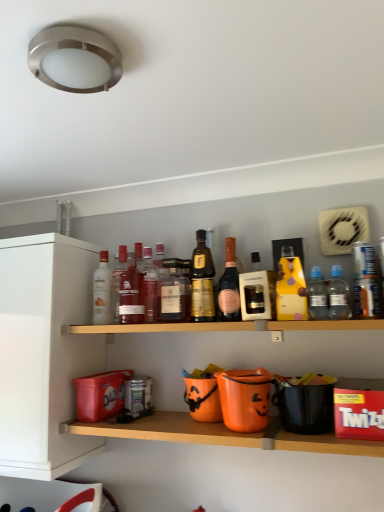
Question: Does matte glass bottle at center, acting as the second bottle starting from the left, have a greater height compared to clear plastic bottle at center right, placed as the 2th bottle when sorted from right to left?

Choices:
 (A) yes
 (B) no

Answer: (A)

Question: Can you see matte glass bottle at center, acting as the second bottle starting from the left, touching clear plastic bottle at center right, placed as the 2th bottle when sorted from right to left?

Choices:
 (A) no
 (B) yes

Answer: (A)

Question: From the image's perspective, is matte glass bottle at center, marked as the eighth bottle in a right-to-left arrangement, above clear plastic bottle at center right, placed as the 2th bottle when sorted from right to left?

Choices:
 (A) no
 (B) yes

Answer: (A)

Question: Can you confirm if matte glass bottle at center, marked as the eighth bottle in a right-to-left arrangement, is wider than clear plastic bottle at center right, which appears as the 8th bottle when viewed from the left?

Choices:
 (A) no
 (B) yes

Answer: (B)

Question: From a real-world perspective, does matte glass bottle at center, marked as the eighth bottle in a right-to-left arrangement, stand above clear plastic bottle at center right, which appears as the 8th bottle when viewed from the left?

Choices:
 (A) yes
 (B) no

Answer: (A)

Question: Is matte glass bottle at center, acting as the second bottle starting from the left, facing away from clear plastic bottle at center right, which appears as the 8th bottle when viewed from the left?

Choices:
 (A) no
 (B) yes

Answer: (A)

Question: From a real-world perspective, does clear plastic bottle at right, the 9th bottle positioned from the left, sit lower than orange plastic buckets at lower center, the 1th shelf ordered from the bottom?

Choices:
 (A) yes
 (B) no

Answer: (B)

Question: Is clear plastic bottle at right, the 9th bottle positioned from the left, bigger than orange plastic buckets at lower center, acting as the second shelf starting from the top?

Choices:
 (A) no
 (B) yes

Answer: (A)

Question: Is clear plastic bottle at right, marked as the first bottle in a right-to-left arrangement, positioned in front of orange plastic buckets at lower center, acting as the second shelf starting from the top?

Choices:
 (A) yes
 (B) no

Answer: (B)

Question: Would you say orange plastic buckets at lower center, acting as the second shelf starting from the top, is part of clear plastic bottle at right, marked as the first bottle in a right-to-left arrangement,'s contents?

Choices:
 (A) no
 (B) yes

Answer: (A)

Question: Does clear plastic bottle at right, marked as the first bottle in a right-to-left arrangement, come behind orange plastic buckets at lower center, acting as the second shelf starting from the top?

Choices:
 (A) no
 (B) yes

Answer: (B)

Question: Is clear plastic bottle at right, marked as the first bottle in a right-to-left arrangement, not near orange plastic buckets at lower center, acting as the second shelf starting from the top?

Choices:
 (A) yes
 (B) no

Answer: (B)

Question: Does gold metallic bottle at center, which ranks as the 6th bottle in left-to-right order, appear on the left side of clear plastic bottle at center right, placed as the 2th bottle when sorted from right to left?

Choices:
 (A) no
 (B) yes

Answer: (B)